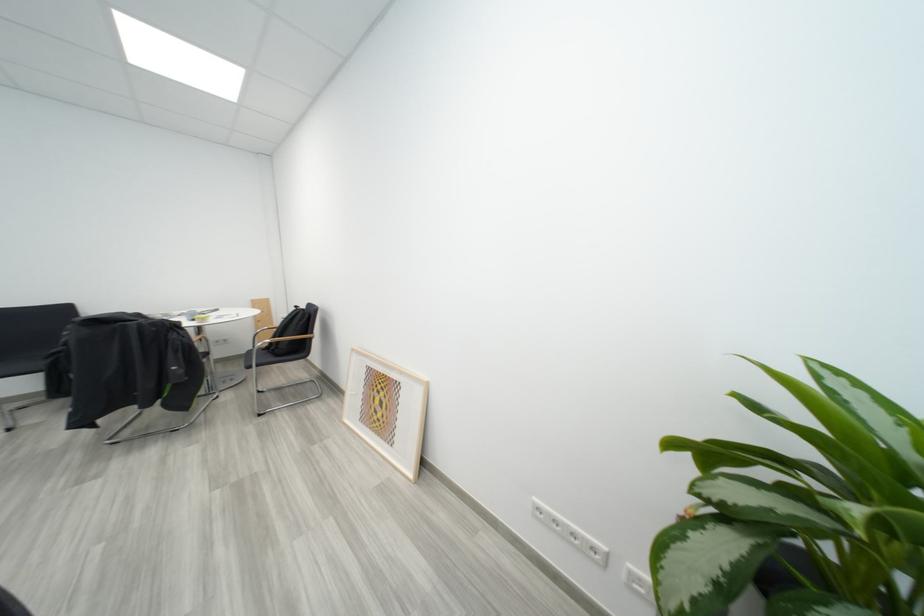
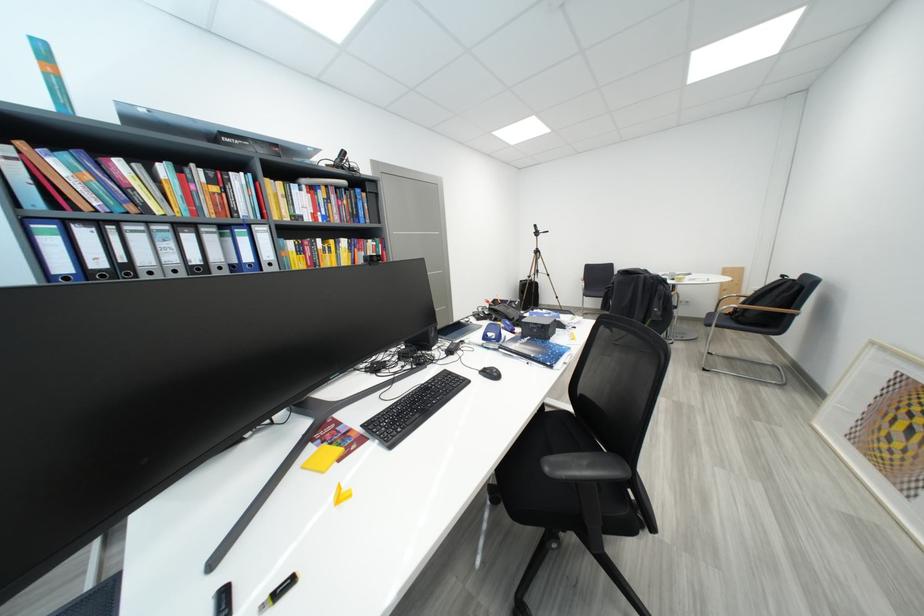
Where in the second image is the point corresponding to (361,352) from the first image?

(881, 346)